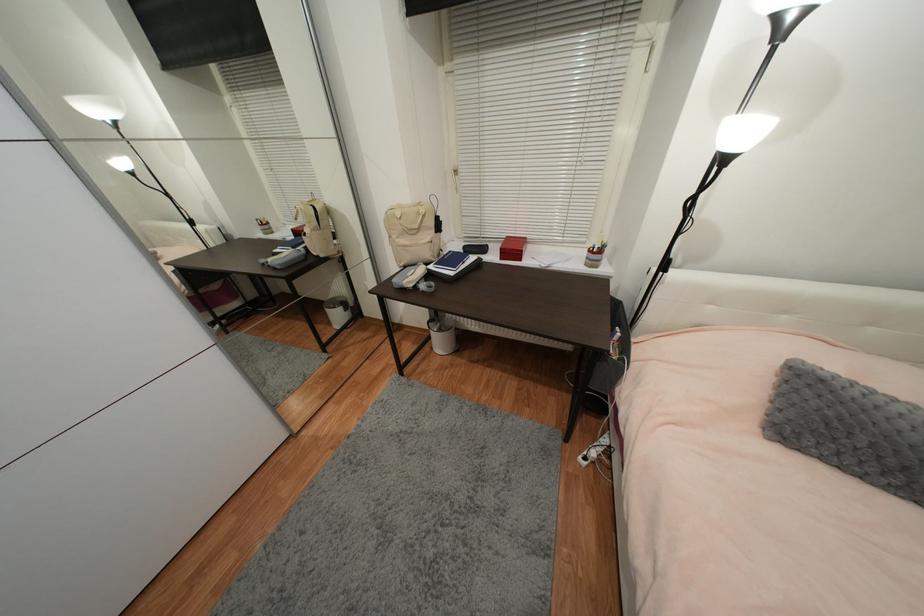
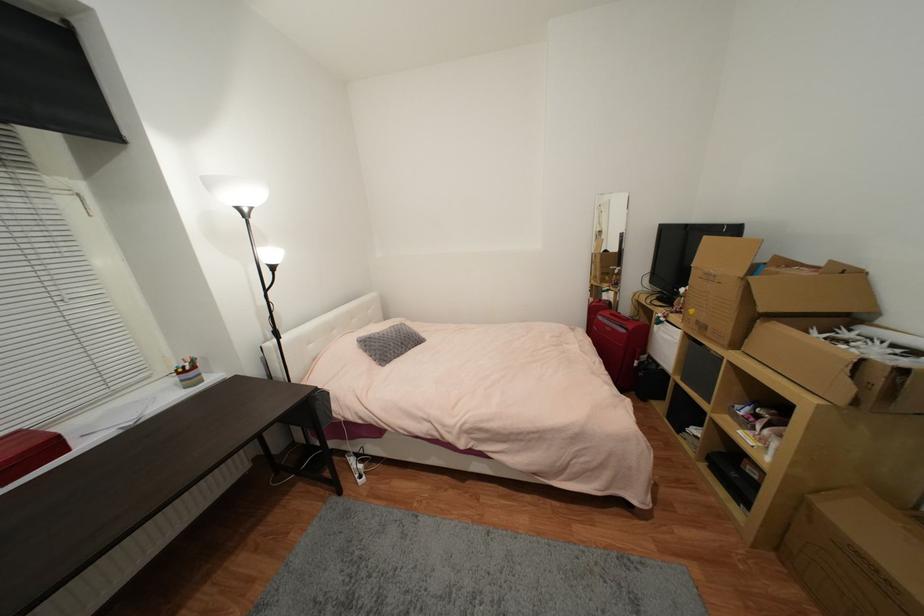
Where in the second image is the point corresponding to (x=593, y=253) from the first image?

(185, 374)